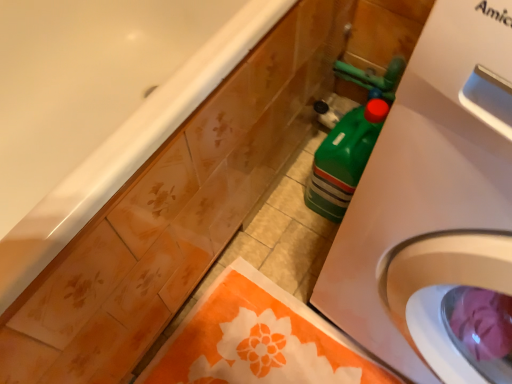
Where is `white plastic washing machine at right`? Image resolution: width=512 pixels, height=384 pixels. white plastic washing machine at right is located at coordinates (430, 186).

Find the location of a particular element. This screenshot has width=512, height=384. white glossy bathtub at upper left is located at coordinates (127, 149).

Can you confirm if orange fabric towel at lower center is thinner than white plastic washing machine at right?

Indeed, orange fabric towel at lower center has a lesser width compared to white plastic washing machine at right.

From the image's perspective, between orange fabric towel at lower center and white plastic washing machine at right, which one is located above?

From the image's view, white plastic washing machine at right is above.

Is orange fabric towel at lower center beside white plastic washing machine at right?

No, orange fabric towel at lower center is not next to white plastic washing machine at right.

Does point (242, 353) come farther from viewer compared to point (407, 247)?

Yes, point (242, 353) is behind point (407, 247).

Can we say white plastic washing machine at right lies outside orange fabric towel at lower center?

Absolutely, white plastic washing machine at right is external to orange fabric towel at lower center.

From the image's perspective, who appears lower, white plastic washing machine at right or orange fabric towel at lower center?

orange fabric towel at lower center, from the image's perspective.

Does white plastic washing machine at right have a lesser width compared to orange fabric towel at lower center?

No.

Looking at the image, does white plastic washing machine at right seem bigger or smaller compared to orange fabric towel at lower center?

Clearly, white plastic washing machine at right is larger in size than orange fabric towel at lower center.

Considering the relative positions of orange fabric towel at lower center and white glossy bathtub at upper left in the image provided, is orange fabric towel at lower center to the left of white glossy bathtub at upper left from the viewer's perspective?

No.

Choose the correct answer: Is orange fabric towel at lower center inside white glossy bathtub at upper left or outside it?

orange fabric towel at lower center is located beyond the bounds of white glossy bathtub at upper left.

From a real-world perspective, is orange fabric towel at lower center on top of white glossy bathtub at upper left?

No, from a real-world perspective, orange fabric towel at lower center is not above white glossy bathtub at upper left.

Considering the relative positions of orange fabric towel at lower center and white glossy bathtub at upper left in the image provided, is orange fabric towel at lower center in front of white glossy bathtub at upper left?

That is False.

Which is in front, white plastic washing machine at right or white glossy bathtub at upper left?

Positioned in front is white plastic washing machine at right.

From a real-world perspective, which object stands above the other?

In real-world perspective, white plastic washing machine at right is above.

Can we say white plastic washing machine at right lies outside white glossy bathtub at upper left?

A: Yes, white plastic washing machine at right is located beyond the bounds of white glossy bathtub at upper left.

Which is nearer, (484,260) or (106,148)?

The point (484,260) is in front.

From the image's perspective, is white glossy bathtub at upper left located beneath white plastic washing machine at right?

No, from the image's perspective, white glossy bathtub at upper left is not below white plastic washing machine at right.

Looking at this image, can you confirm if white glossy bathtub at upper left is positioned to the left of white plastic washing machine at right?

Yes.

Does white glossy bathtub at upper left have a greater height compared to white plastic washing machine at right?

No.

Is white glossy bathtub at upper left oriented towards white plastic washing machine at right?

Yes, white glossy bathtub at upper left faces towards white plastic washing machine at right.

There is a orange fabric towel at lower center. At what (x,y) coordinates should I click in order to perform the action: click on bathtub above it (from a real-world perspective). Please return your answer as a coordinate pair (x, y). Looking at the image, I should click on (127, 149).

Would you say white glossy bathtub at upper left is to the left or to the right of orange fabric towel at lower center in the picture?

Clearly, white glossy bathtub at upper left is on the left of orange fabric towel at lower center in the image.

Is white glossy bathtub at upper left completely or partially outside of orange fabric towel at lower center?

That's correct, white glossy bathtub at upper left is outside of orange fabric towel at lower center.

Which of these two, white glossy bathtub at upper left or orange fabric towel at lower center, is bigger?

Bigger between the two is white glossy bathtub at upper left.

In the image, there is a orange fabric towel at lower center. Where is `washing machine above it (from the image's perspective)`? The width and height of the screenshot is (512, 384). washing machine above it (from the image's perspective) is located at coordinates (430, 186).

This screenshot has width=512, height=384. I want to click on washing machine that appears in front of the orange fabric towel at lower center, so click(430, 186).

In the scene shown: Estimate the real-world distances between objects in this image. Which object is closer to orange fabric towel at lower center, white plastic washing machine at right or white glossy bathtub at upper left?

Among the two, white plastic washing machine at right is located nearer to orange fabric towel at lower center.

Based on their spatial positions, is white plastic washing machine at right or orange fabric towel at lower center closer to white glossy bathtub at upper left?

white plastic washing machine at right lies closer to white glossy bathtub at upper left than the other object.

From the image, which object appears to be farther from white plastic washing machine at right, orange fabric towel at lower center or white glossy bathtub at upper left?

orange fabric towel at lower center lies further to white plastic washing machine at right than the other object.

When comparing their distances from white glossy bathtub at upper left, does orange fabric towel at lower center or white plastic washing machine at right seem closer?

The object closer to white glossy bathtub at upper left is white plastic washing machine at right.

Looking at the image, which one is located further to white plastic washing machine at right, white glossy bathtub at upper left or orange fabric towel at lower center?

orange fabric towel at lower center.

Estimate the real-world distances between objects in this image. Which object is further from orange fabric towel at lower center, white glossy bathtub at upper left or white plastic washing machine at right?

white glossy bathtub at upper left.

Where is `beach towel located between white glossy bathtub at upper left and white plastic washing machine at right in the left-right direction`? beach towel located between white glossy bathtub at upper left and white plastic washing machine at right in the left-right direction is located at coordinates pyautogui.click(x=258, y=340).